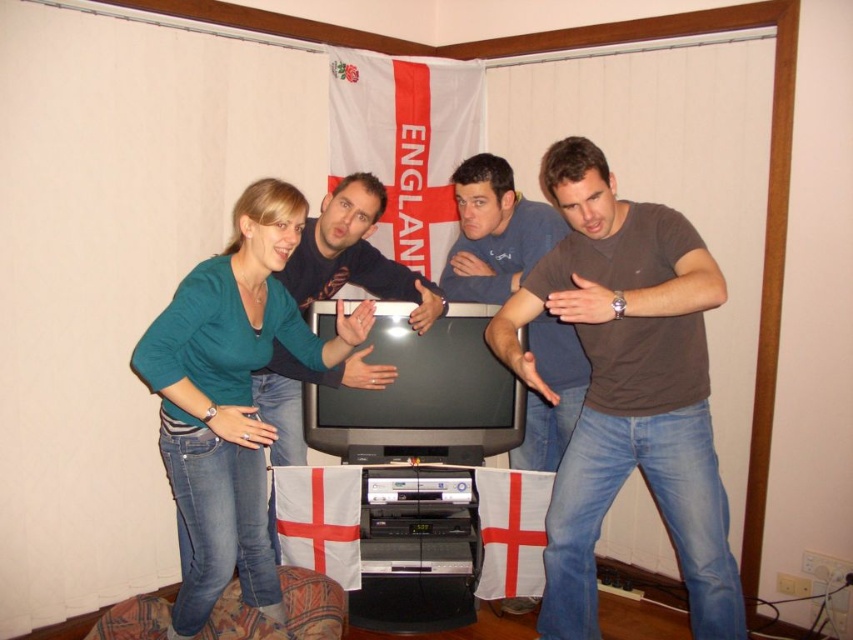
Consider the image. Between dark brown t-shirt at center and dark blue shirt at center, which one is positioned lower?

dark blue shirt at center

Who is shorter, dark brown t-shirt at center or dark blue shirt at center?

Standing shorter between the two is dark brown t-shirt at center.

Identify the location of dark brown t-shirt at center. (494, 232).

Does green matte shirt at center have a larger size compared to dark brown t-shirt at center?

Yes, green matte shirt at center is bigger than dark brown t-shirt at center.

Is green matte shirt at center shorter than dark brown t-shirt at center?

Incorrect, green matte shirt at center's height does not fall short of dark brown t-shirt at center's.

Between point (265, 566) and point (538, 321), which one is positioned behind?

The point (538, 321) is behind.

The width and height of the screenshot is (853, 640). I want to click on green matte shirt at center, so click(230, 397).

What are the coordinates of `brown cotton t-shirt at center` in the screenshot? It's located at (627, 388).

Can you confirm if brown cotton t-shirt at center is taller than green matte shirt at center?

Yes.

Between point (579, 205) and point (204, 412), which one is positioned in front?

Positioned in front is point (579, 205).

The image size is (853, 640). What are the coordinates of `brown cotton t-shirt at center` in the screenshot? It's located at (627, 388).